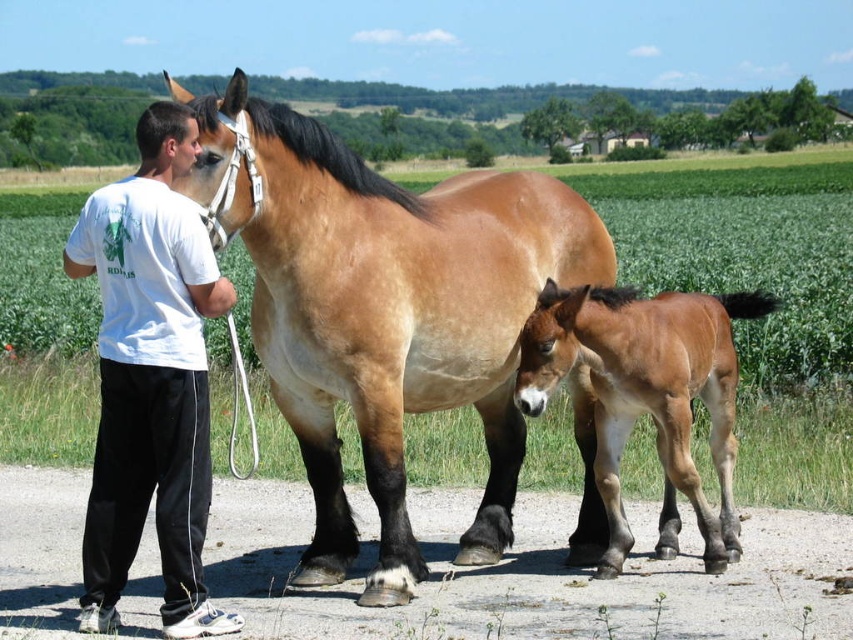
You are standing in the rural scene and want to place a small marker at each of the two points. Which point is closer to you, point (326, 461) or point (96, 497)?

Point (96, 497) is closer to you because it is less far from the camera than point (326, 461).